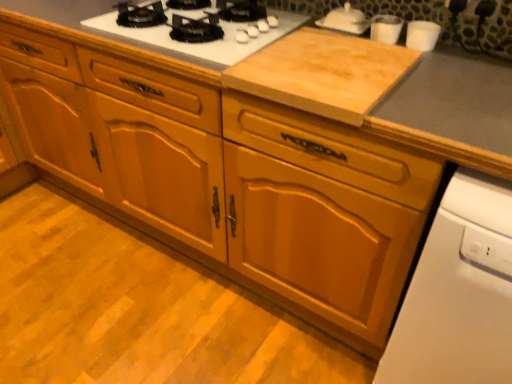
You are a GUI agent. You are given a task and a screenshot of the screen. Output one action in this format:
    pyautogui.click(x=<x>, y=<y>)
    Task: Click on the white glossy teapot at upper right, which is the 1th appliance in left-to-right order
    The width and height of the screenshot is (512, 384).
    Given the screenshot: What is the action you would take?
    pyautogui.click(x=345, y=20)

The width and height of the screenshot is (512, 384). In order to click on clear glass cups at upper right, the 2th appliance viewed from the right in this screenshot , I will do `click(385, 28)`.

Locate an element on the screen. The height and width of the screenshot is (384, 512). natural wood cutting board at center is located at coordinates (323, 73).

Describe the element at coordinates (323, 73) in the screenshot. I see `natural wood cutting board at center` at that location.

You are a GUI agent. You are given a task and a screenshot of the screen. Output one action in this format:
    pyautogui.click(x=<x>, y=<y>)
    Task: Click on the white glossy gas stove at upper center
    The image size is (512, 384).
    Given the screenshot: What is the action you would take?
    (201, 43)

This screenshot has height=384, width=512. I want to click on white glossy teapot at upper right, which is the 1th appliance in left-to-right order, so click(x=345, y=20).

Would you say white glossy cups at upper right, marked as the third appliance in a left-to-right arrangement, is inside or outside white glossy gas stove at upper center?

white glossy cups at upper right, marked as the third appliance in a left-to-right arrangement, is not enclosed by white glossy gas stove at upper center.

From the image's perspective, relative to white glossy gas stove at upper center, is white glossy cups at upper right, marked as the third appliance in a left-to-right arrangement, above or below?

white glossy cups at upper right, marked as the third appliance in a left-to-right arrangement, is situated lower than white glossy gas stove at upper center in the image.

At what (x,y) coordinates should I click in order to perform the action: click on the 1st appliance behind the white glossy gas stove at upper center. Please return your answer as a coordinate pair (x, y). This screenshot has width=512, height=384. Looking at the image, I should click on (422, 35).

Can you tell me how much white glossy cups at upper right, the first appliance in the right-to-left sequence, and white glossy gas stove at upper center differ in facing direction?

white glossy cups at upper right, the first appliance in the right-to-left sequence, and white glossy gas stove at upper center are facing 0.00264 degrees away from each other.

Where is `the 2nd appliance counting from the left of the white glossy cups at upper right, marked as the third appliance in a left-to-right arrangement`? the 2nd appliance counting from the left of the white glossy cups at upper right, marked as the third appliance in a left-to-right arrangement is located at coordinates (345, 20).

Is white glossy teapot at upper right, arranged as the third appliance when viewed from the right, not close to white glossy cups at upper right, marked as the third appliance in a left-to-right arrangement?

white glossy teapot at upper right, arranged as the third appliance when viewed from the right, is near white glossy cups at upper right, marked as the third appliance in a left-to-right arrangement, not far away.

From the image's perspective, is white glossy teapot at upper right, arranged as the third appliance when viewed from the right, under white glossy cups at upper right, the first appliance in the right-to-left sequence?

Actually, white glossy teapot at upper right, arranged as the third appliance when viewed from the right, appears above white glossy cups at upper right, the first appliance in the right-to-left sequence, in the image.

Can you confirm if white glossy teapot at upper right, arranged as the third appliance when viewed from the right, is smaller than white glossy cups at upper right, marked as the third appliance in a left-to-right arrangement?

No, white glossy teapot at upper right, arranged as the third appliance when viewed from the right, is not smaller than white glossy cups at upper right, marked as the third appliance in a left-to-right arrangement.

Which of these two, natural wood cutting board at center or clear glass cups at upper right, arranged as the 2th appliance when viewed from the left, is bigger?

natural wood cutting board at center is bigger.

Is natural wood cutting board at center outside of clear glass cups at upper right, arranged as the 2th appliance when viewed from the left?

Yes, natural wood cutting board at center is located beyond the bounds of clear glass cups at upper right, arranged as the 2th appliance when viewed from the left.

Consider the image. Is natural wood cutting board at center facing towards clear glass cups at upper right, arranged as the 2th appliance when viewed from the left?

No, natural wood cutting board at center is not turned towards clear glass cups at upper right, arranged as the 2th appliance when viewed from the left.

From the image's perspective, which is below, natural wood cutting board at center or clear glass cups at upper right, the 2th appliance viewed from the right?

natural wood cutting board at center.

From a real-world perspective, which appliance is the 2nd one above the white glossy gas stove at upper center? Please provide its 2D coordinates.

[(422, 35)]

From the image's perspective, which is below, white glossy gas stove at upper center or white glossy cups at upper right, marked as the third appliance in a left-to-right arrangement?

white glossy cups at upper right, marked as the third appliance in a left-to-right arrangement.

Between point (200, 55) and point (411, 30), which one is positioned in front?

Positioned in front is point (200, 55).

In the scene shown: Is white glossy gas stove at upper center oriented towards white glossy cups at upper right, the first appliance in the right-to-left sequence?

No.

Does white glossy cups at upper right, the first appliance in the right-to-left sequence, have a smaller size compared to clear glass cups at upper right, arranged as the 2th appliance when viewed from the left?

Indeed, white glossy cups at upper right, the first appliance in the right-to-left sequence, has a smaller size compared to clear glass cups at upper right, arranged as the 2th appliance when viewed from the left.

Consider the image. Which is less distant, (422, 42) or (387, 31)?

Point (422, 42)

Considering the relative sizes of white glossy cups at upper right, marked as the third appliance in a left-to-right arrangement, and clear glass cups at upper right, the 2th appliance viewed from the right, in the image provided, is white glossy cups at upper right, marked as the third appliance in a left-to-right arrangement, wider than clear glass cups at upper right, the 2th appliance viewed from the right,?

Correct, the width of white glossy cups at upper right, marked as the third appliance in a left-to-right arrangement, exceeds that of clear glass cups at upper right, the 2th appliance viewed from the right.

Which appliance is the 1st one when counting from the back of the white glossy cups at upper right, the first appliance in the right-to-left sequence? Please provide its 2D coordinates.

[(385, 28)]

Can you confirm if white glossy teapot at upper right, which is the 1th appliance in left-to-right order, is thinner than white glossy dishwasher at lower right?

Correct, the width of white glossy teapot at upper right, which is the 1th appliance in left-to-right order, is less than that of white glossy dishwasher at lower right.

Is white glossy teapot at upper right, arranged as the third appliance when viewed from the right, not near white glossy dishwasher at lower right?

That's not correct — white glossy teapot at upper right, arranged as the third appliance when viewed from the right, is a little close to white glossy dishwasher at lower right.

From a real-world perspective, between white glossy teapot at upper right, which is the 1th appliance in left-to-right order, and white glossy dishwasher at lower right, who is vertically higher?

In real-world perspective, white glossy teapot at upper right, which is the 1th appliance in left-to-right order, is above.

Is white glossy teapot at upper right, which is the 1th appliance in left-to-right order, smaller than white glossy dishwasher at lower right?

Correct, white glossy teapot at upper right, which is the 1th appliance in left-to-right order, occupies less space than white glossy dishwasher at lower right.

Considering the relative sizes of white glossy cups at upper right, the first appliance in the right-to-left sequence, and natural wood cutting board at center in the image provided, is white glossy cups at upper right, the first appliance in the right-to-left sequence, taller than natural wood cutting board at center?

Correct, white glossy cups at upper right, the first appliance in the right-to-left sequence, is much taller as natural wood cutting board at center.

Between white glossy cups at upper right, marked as the third appliance in a left-to-right arrangement, and natural wood cutting board at center, which one is positioned behind?

white glossy cups at upper right, marked as the third appliance in a left-to-right arrangement.

From the natural wood cutting board at center, count 3rd appliance to the right and point to it. Please provide its 2D coordinates.

[(422, 35)]

You are a GUI agent. You are given a task and a screenshot of the screen. Output one action in this format:
    pyautogui.click(x=<x>, y=<y>)
    Task: Click on the gas stove below the white glossy cups at upper right, the first appliance in the right-to-left sequence (from a real-world perspective)
    Image resolution: width=512 pixels, height=384 pixels.
    Given the screenshot: What is the action you would take?
    pyautogui.click(x=201, y=43)

Locate an element on the screen. the 2nd appliance to the left when counting from the white glossy cups at upper right, marked as the third appliance in a left-to-right arrangement is located at coordinates (345, 20).

Which object lies nearer to the anchor point white glossy cups at upper right, marked as the third appliance in a left-to-right arrangement, white glossy gas stove at upper center or clear glass cups at upper right, arranged as the 2th appliance when viewed from the left?

clear glass cups at upper right, arranged as the 2th appliance when viewed from the left, is closer to white glossy cups at upper right, marked as the third appliance in a left-to-right arrangement.

From the image, which object appears to be nearer to natural wood cutting board at center, white glossy gas stove at upper center or white glossy teapot at upper right, arranged as the third appliance when viewed from the right?

Based on the image, white glossy gas stove at upper center appears to be nearer to natural wood cutting board at center.

Which object lies nearer to the anchor point white glossy cups at upper right, the first appliance in the right-to-left sequence, white glossy dishwasher at lower right or white glossy gas stove at upper center?

white glossy gas stove at upper center lies closer to white glossy cups at upper right, the first appliance in the right-to-left sequence, than the other object.

Considering their positions, is white glossy teapot at upper right, which is the 1th appliance in left-to-right order, positioned further to white glossy dishwasher at lower right than white glossy cups at upper right, marked as the third appliance in a left-to-right arrangement?

white glossy teapot at upper right, which is the 1th appliance in left-to-right order.

Looking at the image, which one is located further to white glossy teapot at upper right, arranged as the third appliance when viewed from the right, white glossy gas stove at upper center or white glossy cups at upper right, marked as the third appliance in a left-to-right arrangement?

Based on the image, white glossy gas stove at upper center appears to be further to white glossy teapot at upper right, arranged as the third appliance when viewed from the right.

Looking at the image, which one is located further to white glossy cups at upper right, the first appliance in the right-to-left sequence, white glossy teapot at upper right, arranged as the third appliance when viewed from the right, or white glossy gas stove at upper center?

The object further to white glossy cups at upper right, the first appliance in the right-to-left sequence, is white glossy gas stove at upper center.

From the image, which object appears to be nearer to white glossy teapot at upper right, which is the 1th appliance in left-to-right order, white glossy dishwasher at lower right or white glossy gas stove at upper center?

The object closer to white glossy teapot at upper right, which is the 1th appliance in left-to-right order, is white glossy gas stove at upper center.

Considering their positions, is white glossy gas stove at upper center positioned closer to white glossy cups at upper right, the first appliance in the right-to-left sequence, than white glossy teapot at upper right, arranged as the third appliance when viewed from the right?

white glossy teapot at upper right, arranged as the third appliance when viewed from the right, is closer to white glossy cups at upper right, the first appliance in the right-to-left sequence.

Find the location of a particular element. The image size is (512, 384). appliance located between white glossy teapot at upper right, arranged as the third appliance when viewed from the right, and white glossy cups at upper right, marked as the third appliance in a left-to-right arrangement, in the left-right direction is located at coordinates (385, 28).

Where is `appliance situated between white glossy gas stove at upper center and clear glass cups at upper right, the 2th appliance viewed from the right, from left to right`? This screenshot has height=384, width=512. appliance situated between white glossy gas stove at upper center and clear glass cups at upper right, the 2th appliance viewed from the right, from left to right is located at coordinates coord(345,20).

What are the coordinates of `plywood between clear glass cups at upper right, arranged as the 2th appliance when viewed from the left, and white glossy dishwasher at lower right from top to bottom` in the screenshot? It's located at (323, 73).

At what (x,y) coordinates should I click in order to perform the action: click on appliance between clear glass cups at upper right, the 2th appliance viewed from the right, and white glossy dishwasher at lower right from top to bottom. Please return your answer as a coordinate pair (x, y). Looking at the image, I should click on (422, 35).